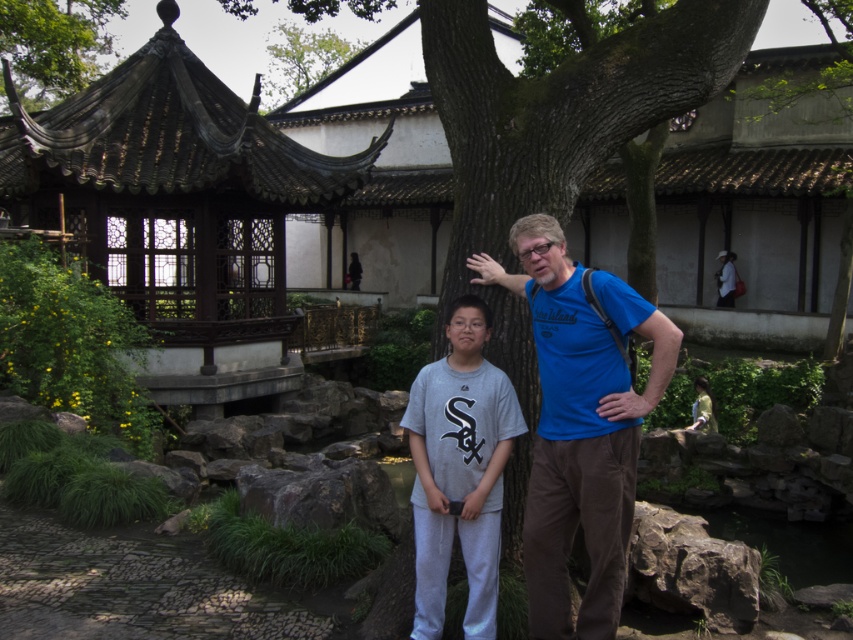
Is blue cotton shirt at center thinner than smooth brown tree trunk at upper left?

Yes.

From the picture: Who is more forward, (535, 472) or (16, 61)?

Point (535, 472) is more forward.

Locate an element on the screen. The height and width of the screenshot is (640, 853). blue cotton shirt at center is located at coordinates (579, 426).

From the picture: Who is positioned more to the right, smooth brown tree trunk at upper left or green leafy tree at upper center?

green leafy tree at upper center

Between point (54, 68) and point (339, 56), which one is positioned in front?

Positioned in front is point (54, 68).

Which is in front, point (117, 13) or point (341, 42)?

Point (341, 42) is in front.

What are the coordinates of `smooth brown tree trunk at upper left` in the screenshot? It's located at point(54,44).

Does blue cotton shirt at center appear on the left side of gray sweatpants at center?

In fact, blue cotton shirt at center is to the right of gray sweatpants at center.

Does blue cotton shirt at center lie in front of gray sweatpants at center?

Yes, blue cotton shirt at center is closer to the viewer.

Is point (669, 332) less distant than point (427, 573)?

Yes, point (669, 332) is closer to viewer.

Locate an element on the screen. The width and height of the screenshot is (853, 640). blue cotton shirt at center is located at coordinates (579, 426).